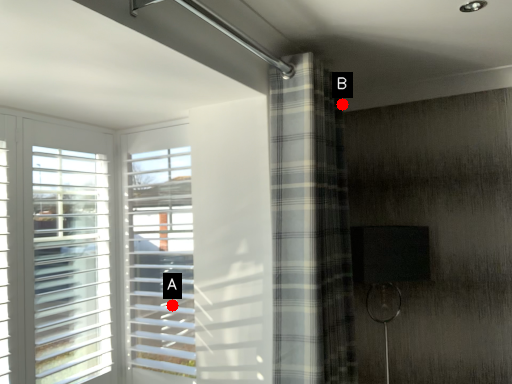
Question: Two points are circled on the image, labeled by A and B beside each circle. Which of the following is the farthest from the observer?

Choices:
 (A) A is further
 (B) B is further

Answer: (B)